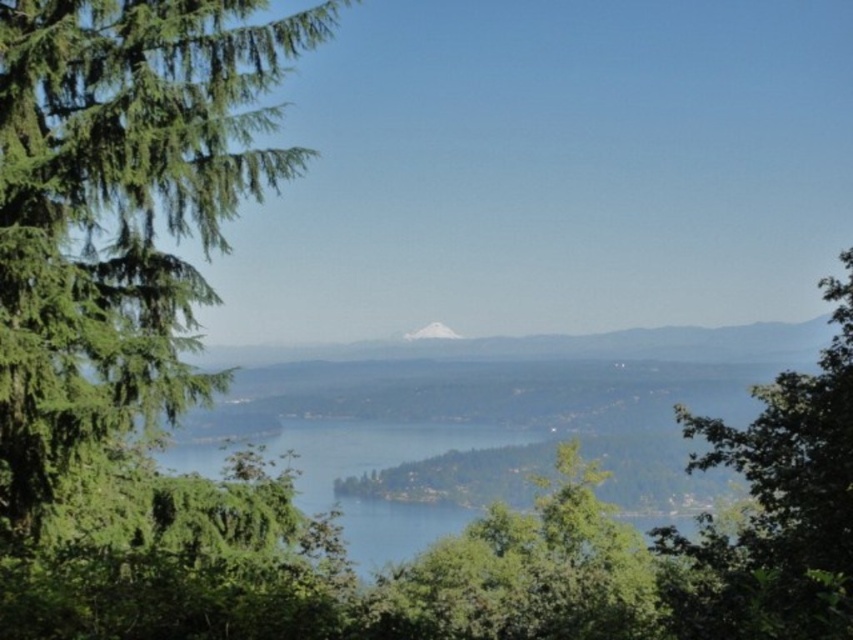
You are standing in the scenic landscape and want to take a photo of both the green leafy tree at left and the green leafy tree at center. Which tree should you focus on first if you want to include both in your photo without zooming in too much?

The green leafy tree at left has a lesser width compared to the green leafy tree at center. To include both without zooming in too much, focus on the wider green leafy tree at center first, then adjust the frame to include the narrower green leafy tree at left.

You are an environmental scientist assessing the health of a forest. You observe the green leafy tree at left and the green leafy tree at center in the image. Which tree would you prioritize for further study based on their spatial presence in the scene?

The green leafy tree at center should be prioritized for further study because it occupies more space than the green leafy tree at left, indicating it may be larger or more dominant in the ecosystem.